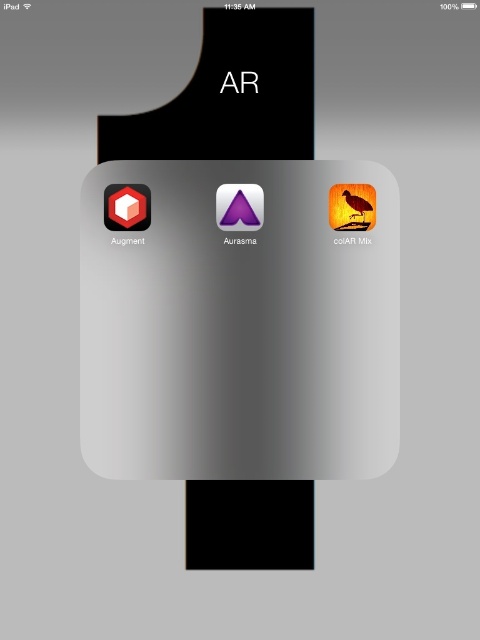
You are designing a digital display for an AR app folder. The folder contains two icons, the matte black cube at center and the matte purple triangle at center. Which icon takes up more vertical space in the folder?

The matte black cube at center has a greater height compared to the matte purple triangle at center, so it takes up more vertical space in the folder.

You are using an iPad and want to open the Aurasma app. You see the folder labeled AR with the matte red cube at center and the matte purple triangle at center. Which app icon is located above the other?

The matte red cube at center is above the matte purple triangle at center.

You are looking at an iPad screen with two icons in the center. The purple glossy triangle at center and the orange glossy bird at center. Which one do you think is bigger?

The purple glossy triangle at center is larger in size compared to the orange glossy bird at center.